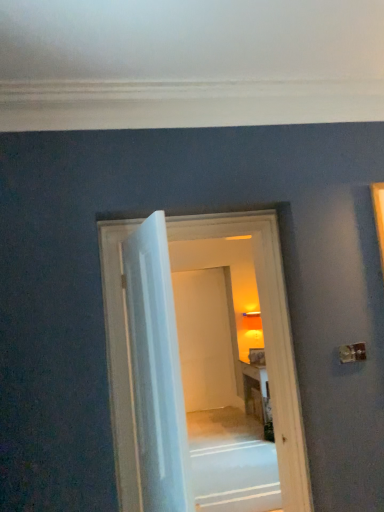
Question: Is point (165, 259) closer or farther from the camera than point (167, 222)?

Choices:
 (A) closer
 (B) farther

Answer: (A)

Question: Considering the relative positions of white glossy door at center, arranged as the 2th door when viewed from the back, and white wooden door at center, the second door positioned from the front, in the image provided, is white glossy door at center, arranged as the 2th door when viewed from the back, to the left or to the right of white wooden door at center, the second door positioned from the front,?

Choices:
 (A) left
 (B) right

Answer: (A)

Question: Considering the positions of white glossy door at center, arranged as the 2th door when viewed from the back, and white wooden door at center, the second door positioned from the front, in the image, is white glossy door at center, arranged as the 2th door when viewed from the back, wider or thinner than white wooden door at center, the second door positioned from the front,?

Choices:
 (A) thin
 (B) wide

Answer: (A)

Question: Looking at the image, does white wooden door at center, the first door from the back, seem bigger or smaller compared to white glossy door at center, marked as the first door in a front-to-back arrangement?

Choices:
 (A) big
 (B) small

Answer: (A)

Question: Is white wooden door at center, the second door positioned from the front, inside the boundaries of white glossy door at center, arranged as the 2th door when viewed from the back, or outside?

Choices:
 (A) inside
 (B) outside

Answer: (B)

Question: Considering the positions of point (114, 294) and point (155, 355), is point (114, 294) closer or farther from the camera than point (155, 355)?

Choices:
 (A) closer
 (B) farther

Answer: (B)

Question: From their relative heights in the image, would you say white wooden door at center, the second door positioned from the front, is taller or shorter than white glossy door at center, marked as the first door in a front-to-back arrangement?

Choices:
 (A) tall
 (B) short

Answer: (A)